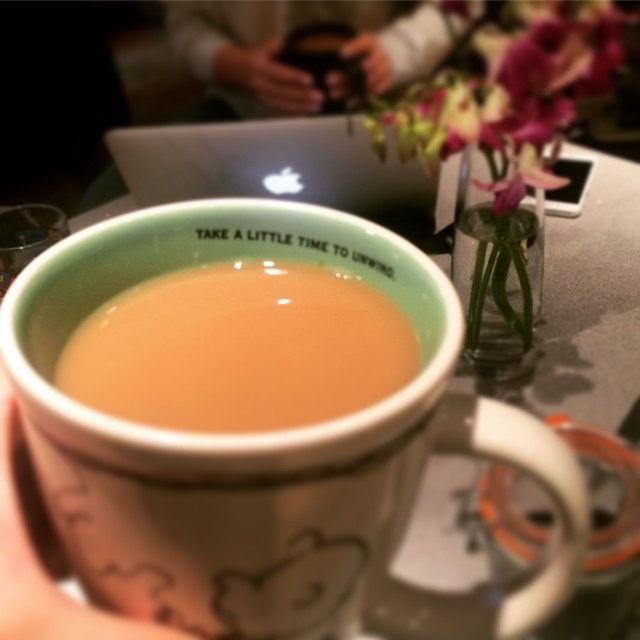
Question: Among these points, which one is farthest from the camera?

Choices:
 (A) (243, 51)
 (B) (198, 22)
 (C) (99, 470)
 (D) (157, 636)

Answer: (A)

Question: Can you confirm if white ceramic mug at center is positioned to the left of matte black phone at upper center?

Choices:
 (A) yes
 (B) no

Answer: (B)

Question: Which point is farther to the camera?

Choices:
 (A) (509, 38)
 (B) (60, 344)
 (C) (35, 508)

Answer: (A)

Question: Which object appears farthest from the camera in this image?

Choices:
 (A) white matte cup at center
 (B) white ceramic mug at center
 (C) purple silk flower at upper right
 (D) smooth leather wallet at upper center

Answer: (D)

Question: Can you confirm if white ceramic mug at center is positioned below brown matte cup at center?

Choices:
 (A) no
 (B) yes

Answer: (B)

Question: Does purple silk flower at upper right appear over matte black phone at upper center?

Choices:
 (A) yes
 (B) no

Answer: (B)